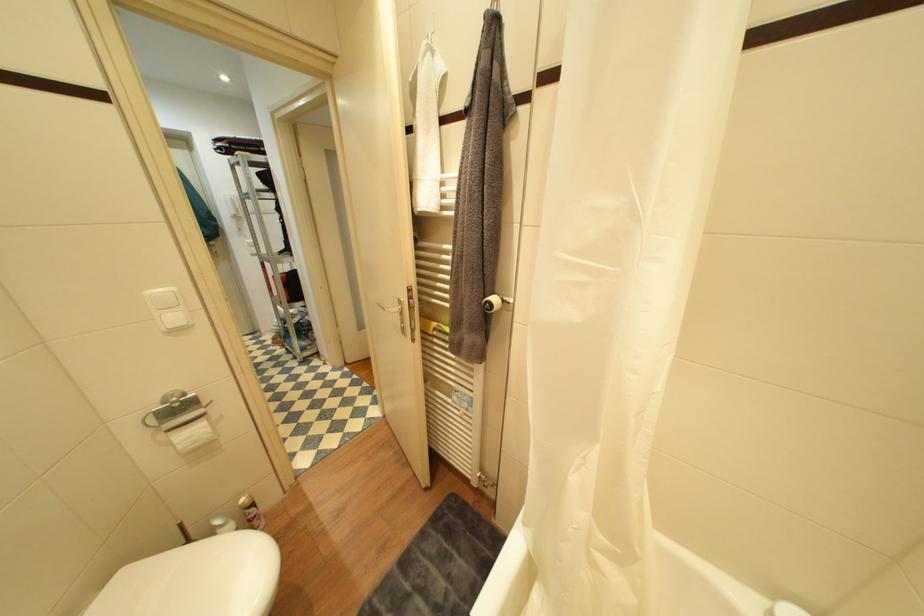
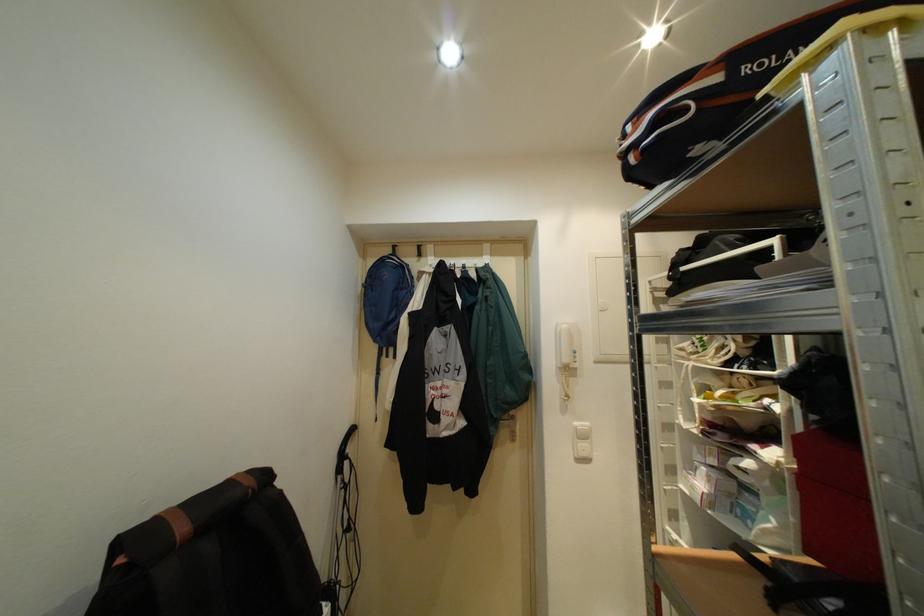
Find the pixel in the second image that matches [237,198] in the first image.

(573, 328)